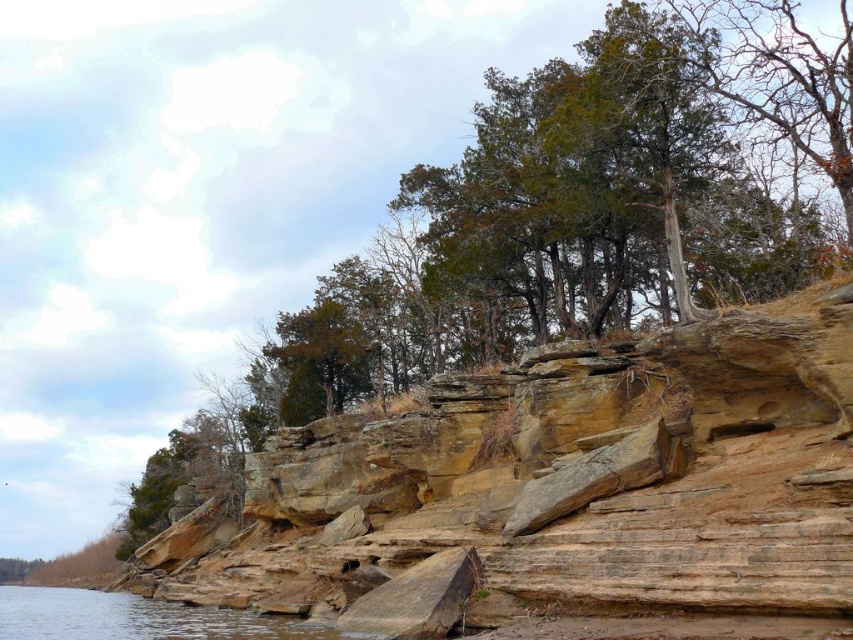
Which is behind, point (599, 618) or point (36, 596)?

The point (36, 596) is behind.

Is point (315, 422) farther from viewer compared to point (71, 620)?

No, (315, 422) is closer to viewer.

Locate an element on the screen. This screenshot has width=853, height=640. yellowish-brown rock at center is located at coordinates (563, 496).

Image resolution: width=853 pixels, height=640 pixels. In order to click on yellowish-brown rock at center in this screenshot , I will do `click(563, 496)`.